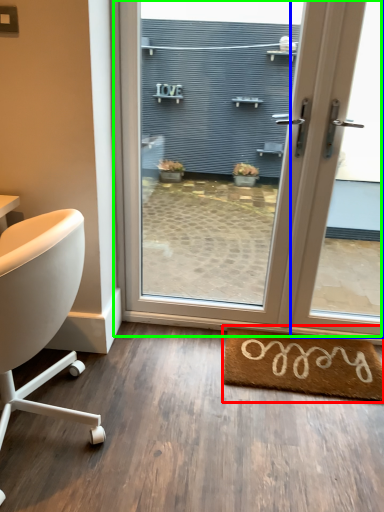
Question: Estimate the real-world distances between objects in this image. Which object is farther from mat (highlighted by a red box), window (highlighted by a blue box) or door (highlighted by a green box)?

Choices:
 (A) window
 (B) door

Answer: (B)